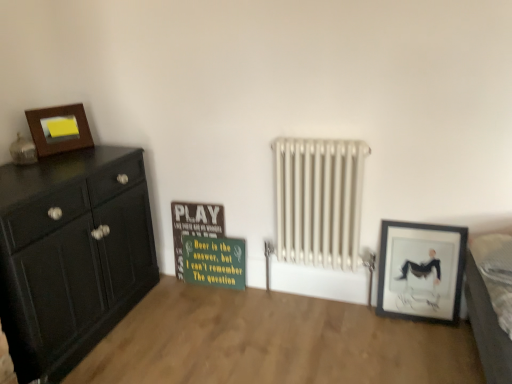
Where is `free spot above green matte signboard at center (from a real-world perspective)`? free spot above green matte signboard at center (from a real-world perspective) is located at coordinates (210, 226).